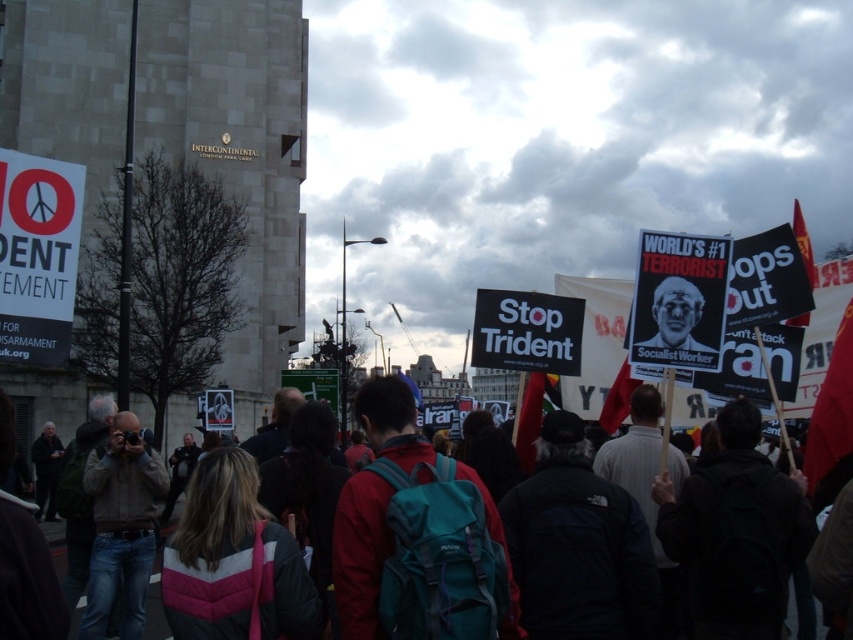
Which is more to the right, teal fabric backpack at center or matte black poster at center?

matte black poster at center is more to the right.

Who is positioned more to the left, teal fabric backpack at center or matte black poster at center?

Positioned to the left is teal fabric backpack at center.

Looking at this image, who is more distant from viewer, (16, 452) or (660, 317)?

The point (16, 452) is behind.

Where is `teal fabric backpack at center`? The width and height of the screenshot is (853, 640). teal fabric backpack at center is located at coordinates (157, 593).